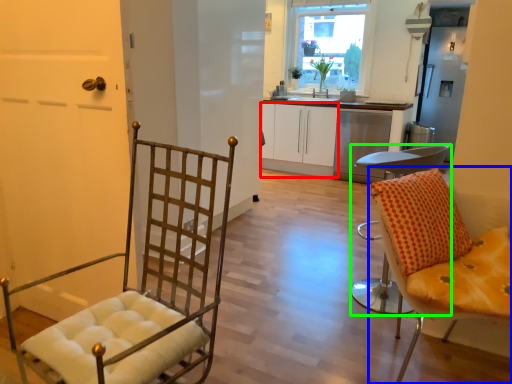
Question: Which object is the closest to the cabinetry (highlighted by a red box)? Choose among these: chair (highlighted by a blue box) or chair (highlighted by a green box).

Choices:
 (A) chair
 (B) chair

Answer: (B)